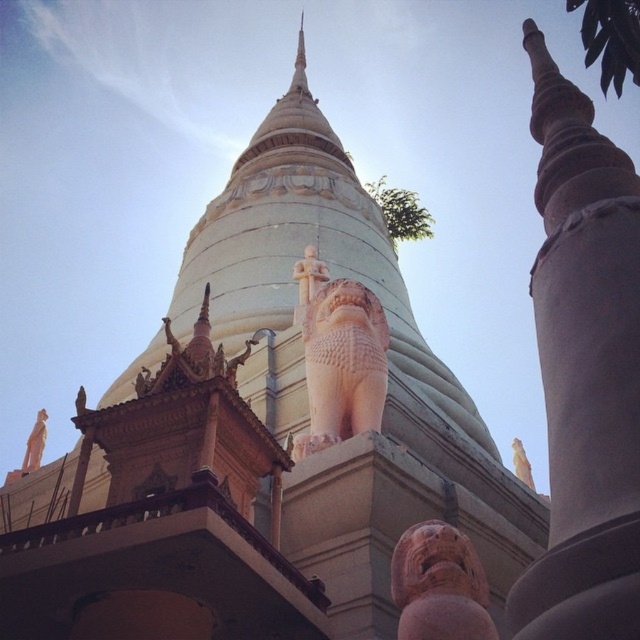
Who is shorter, smooth gray pillar at upper right or matte pink stone lion at center?

matte pink stone lion at center is shorter.

Does smooth gray pillar at upper right lie in front of matte pink stone lion at center?

Yes, it is in front of matte pink stone lion at center.

Who is more forward, (541, 570) or (346, 288)?

Point (541, 570)

Identify the location of smooth gray pillar at upper right. (582, 371).

Which of these two, smooth gray pillar at upper right or matte pink stone lion at lower right, stands taller?

With more height is smooth gray pillar at upper right.

Between smooth gray pillar at upper right and matte pink stone lion at lower right, which one appears on the left side from the viewer's perspective?

matte pink stone lion at lower right is more to the left.

Is point (576, 525) behind point (433, 545)?

No.

This screenshot has height=640, width=640. Find the location of `smooth gray pillar at upper right`. smooth gray pillar at upper right is located at coordinates (582, 371).

Is matte pink stone lion at center bigger than white stone statue at lower left?

No, matte pink stone lion at center is not bigger than white stone statue at lower left.

Who is positioned more to the left, matte pink stone lion at center or white stone statue at lower left?

Positioned to the left is white stone statue at lower left.

Does point (362, 320) come closer to viewer compared to point (40, 413)?

That is True.

At what (x,y) coordinates should I click in order to perform the action: click on matte pink stone lion at center. Please return your answer as a coordinate pair (x, y). The height and width of the screenshot is (640, 640). Looking at the image, I should click on (339, 355).